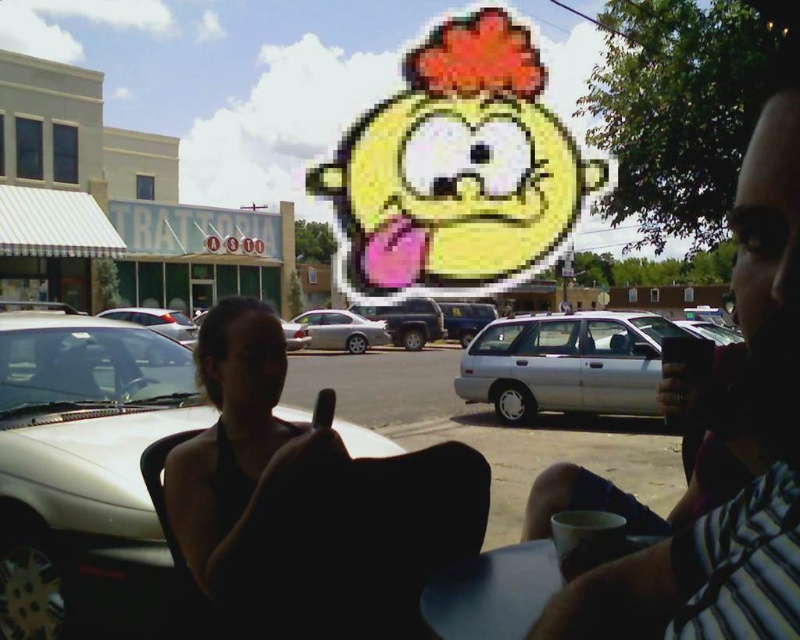
Question: Can you confirm if white matte car at left is positioned to the right of silver metallic station wagon at center?

Choices:
 (A) yes
 (B) no

Answer: (B)

Question: Which point is farther to the camera?

Choices:
 (A) (332, 326)
 (B) (762, 250)
 (C) (504, 596)

Answer: (A)

Question: Among these points, which one is nearest to the camera?

Choices:
 (A) (310, 333)
 (B) (78, 488)
 (C) (616, 342)
 (D) (468, 637)

Answer: (D)

Question: Can you confirm if matte black phone at center is positioned below blue matte table at lower center?

Choices:
 (A) no
 (B) yes

Answer: (A)

Question: Which point is closer to the camera?

Choices:
 (A) (506, 557)
 (B) (324, 316)
 (C) (766, 298)

Answer: (C)

Question: Can you confirm if white matte car at left is smaller than silver metallic station wagon at center?

Choices:
 (A) no
 (B) yes

Answer: (B)